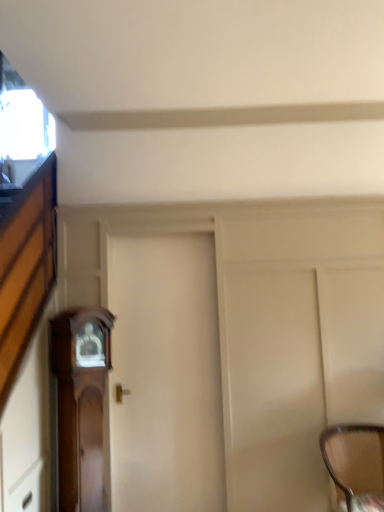
Question: Does wooden drawer at lower left turn towards wooden grandfather clock at left?

Choices:
 (A) yes
 (B) no

Answer: (B)

Question: Does wooden drawer at lower left have a greater height compared to wooden grandfather clock at left?

Choices:
 (A) yes
 (B) no

Answer: (B)

Question: Does wooden drawer at lower left appear on the left side of wooden grandfather clock at left?

Choices:
 (A) yes
 (B) no

Answer: (A)

Question: Considering the relative sizes of wooden drawer at lower left and wooden grandfather clock at left in the image provided, is wooden drawer at lower left shorter than wooden grandfather clock at left?

Choices:
 (A) yes
 (B) no

Answer: (A)

Question: Can you confirm if wooden drawer at lower left is smaller than wooden grandfather clock at left?

Choices:
 (A) yes
 (B) no

Answer: (A)

Question: Is wooden grandfather clock at left a part of wooden drawer at lower left?

Choices:
 (A) no
 (B) yes

Answer: (A)

Question: Considering the relative sizes of white matte door at center and wooden grandfather clock at left in the image provided, is white matte door at center wider than wooden grandfather clock at left?

Choices:
 (A) yes
 (B) no

Answer: (B)

Question: Is white matte door at center behind wooden grandfather clock at left?

Choices:
 (A) yes
 (B) no

Answer: (A)

Question: Does white matte door at center have a larger size compared to wooden grandfather clock at left?

Choices:
 (A) yes
 (B) no

Answer: (A)

Question: Could you tell me if white matte door at center is facing wooden grandfather clock at left?

Choices:
 (A) no
 (B) yes

Answer: (A)

Question: Is wooden grandfather clock at left located within white matte door at center?

Choices:
 (A) yes
 (B) no

Answer: (B)

Question: From a real-world perspective, is white matte door at center over wooden grandfather clock at left?

Choices:
 (A) no
 (B) yes

Answer: (B)

Question: From the image's perspective, is white matte door at center below woven fabric chair at lower right?

Choices:
 (A) yes
 (B) no

Answer: (B)